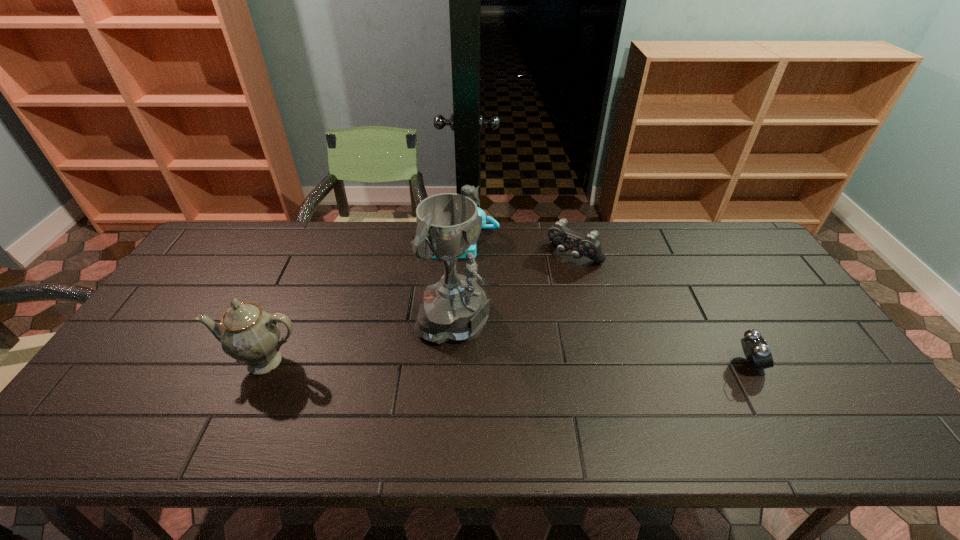
Locate an element on the screen. The width and height of the screenshot is (960, 540). vacant area at the near edge of the desktop is located at coordinates (263, 396).

What are the coordinates of `vacant region at the left edge of the desktop` in the screenshot? It's located at (227, 275).

This screenshot has height=540, width=960. What are the coordinates of `free location at the right edge` in the screenshot? It's located at point(797,331).

In the image, there is a desktop. Identify the location of free space at the far left corner. This screenshot has height=540, width=960. (209, 248).

Where is `blank space at the near left corner of the desktop`? blank space at the near left corner of the desktop is located at coordinates [x=106, y=399].

This screenshot has width=960, height=540. What are the coordinates of `empty space that is in between the third tallest object and the alarm clock` in the screenshot? It's located at (605, 302).

Locate an element on the screen. The image size is (960, 540). free space between the alarm clock and the third tallest object is located at coordinates (605, 302).

This screenshot has width=960, height=540. Identify the location of free space between the leftmost object and the third shortest object. (362, 301).

This screenshot has width=960, height=540. I want to click on free space between the second tallest object and the rightmost object, so click(507, 363).

You are a GUI agent. You are given a task and a screenshot of the screen. Output one action in this format:
    pyautogui.click(x=<x>, y=<y>)
    Task: Click on the free space between the telephone and the rightmost object
    This screenshot has width=960, height=540.
    Given the screenshot: What is the action you would take?
    pyautogui.click(x=605, y=302)